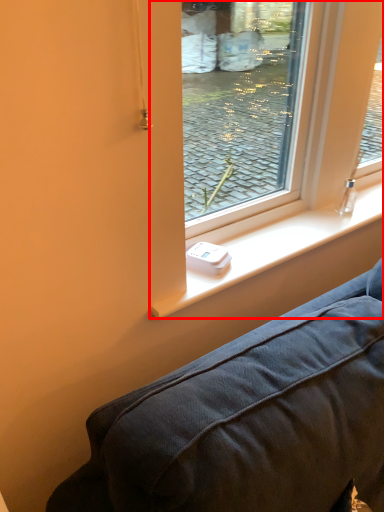
Question: Considering the relative positions of window screen (annotated by the red box) and window sill in the image provided, where is window screen (annotated by the red box) located with respect to the staircase?

Choices:
 (A) left
 (B) right

Answer: (B)